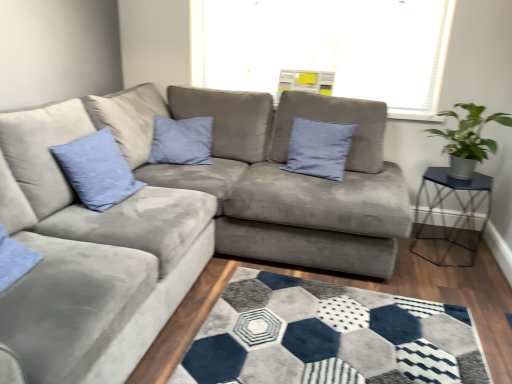
Question: Considering the relative sizes of green leafy plant in metallic pot at right and matte blue cushion at upper left, the second pillow viewed from the back, in the image provided, is green leafy plant in metallic pot at right wider than matte blue cushion at upper left, the second pillow viewed from the back,?

Choices:
 (A) yes
 (B) no

Answer: (A)

Question: Is matte blue cushion at upper left, which ranks as the first pillow in left-to-right order, located within green leafy plant in metallic pot at right?

Choices:
 (A) no
 (B) yes

Answer: (A)

Question: From a real-world perspective, is green leafy plant in metallic pot at right physically below matte blue cushion at upper left, the 1th pillow positioned from the front?

Choices:
 (A) no
 (B) yes

Answer: (A)

Question: Is the surface of green leafy plant in metallic pot at right in direct contact with matte blue cushion at upper left, acting as the 2th pillow starting from the right?

Choices:
 (A) yes
 (B) no

Answer: (B)

Question: Is green leafy plant in metallic pot at right oriented away from matte blue cushion at upper left, the 1th pillow positioned from the front?

Choices:
 (A) no
 (B) yes

Answer: (A)

Question: From their relative heights in the image, would you say blue fabric pillow at center, the 2th pillow in the front-to-back sequence, is taller or shorter than metallic blue glass table at right?

Choices:
 (A) short
 (B) tall

Answer: (A)

Question: From the image's perspective, is blue fabric pillow at center, the first pillow positioned from the right, positioned above or below metallic blue glass table at right?

Choices:
 (A) above
 (B) below

Answer: (A)

Question: Would you say blue fabric pillow at center, the first pillow positioned from the right, is inside or outside metallic blue glass table at right?

Choices:
 (A) inside
 (B) outside

Answer: (B)

Question: In the image, is blue fabric pillow at center, the 2th pillow in the front-to-back sequence, on the left side or the right side of metallic blue glass table at right?

Choices:
 (A) left
 (B) right

Answer: (A)

Question: In the image, is matte blue cushion at upper left, the 1th pillow positioned from the front, positioned in front of or behind green leafy plant in metallic pot at right?

Choices:
 (A) behind
 (B) front

Answer: (B)

Question: Does point pos(86,147) appear closer or farther from the camera than point pos(497,147)?

Choices:
 (A) farther
 (B) closer

Answer: (B)

Question: From the image's perspective, relative to green leafy plant in metallic pot at right, is matte blue cushion at upper left, the 1th pillow positioned from the front, above or below?

Choices:
 (A) above
 (B) below

Answer: (B)

Question: From a real-world perspective, is matte blue cushion at upper left, which ranks as the first pillow in left-to-right order, positioned above or below green leafy plant in metallic pot at right?

Choices:
 (A) below
 (B) above

Answer: (A)

Question: From the image's perspective, relative to green leafy plant in metallic pot at right, is blue fabric pillow at center, which is the second pillow from left to right, above or below?

Choices:
 (A) above
 (B) below

Answer: (A)

Question: Considering the positions of point (287, 158) and point (472, 157), is point (287, 158) closer or farther from the camera than point (472, 157)?

Choices:
 (A) farther
 (B) closer

Answer: (A)